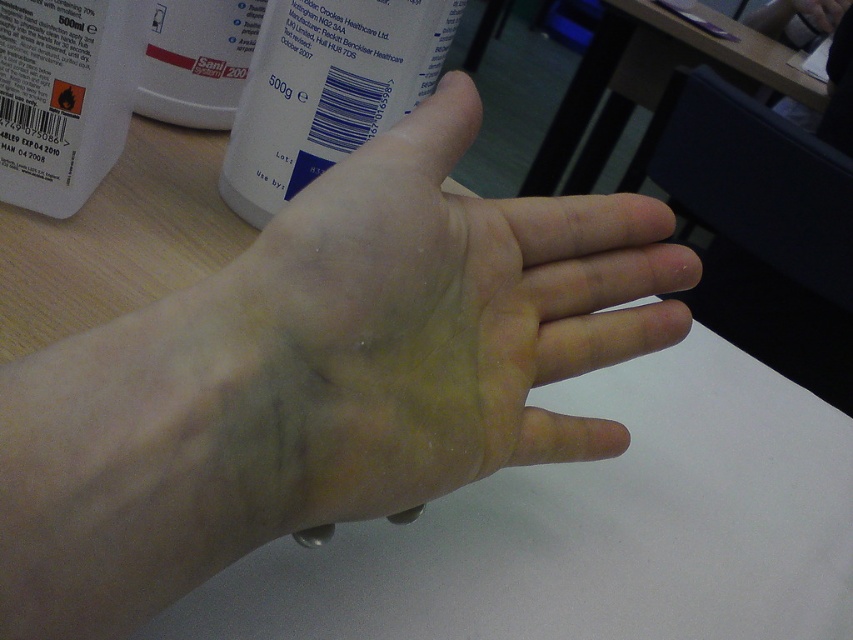
Question: Which object is closer to the camera taking this photo?

Choices:
 (A) pale skin hand at center
 (B) white plastic bottle at upper center

Answer: (A)

Question: Can you confirm if pale skin hand at center is positioned below white plastic bottle at upper center?

Choices:
 (A) no
 (B) yes

Answer: (B)

Question: Is pale skin hand at center closer to the viewer compared to white plastic bottle at upper center?

Choices:
 (A) yes
 (B) no

Answer: (A)

Question: Which point is farther to the camera?

Choices:
 (A) pale skin hand at center
 (B) white plastic bottle at upper center

Answer: (B)

Question: Does pale skin hand at center have a smaller size compared to white plastic bottle at upper center?

Choices:
 (A) yes
 (B) no

Answer: (B)